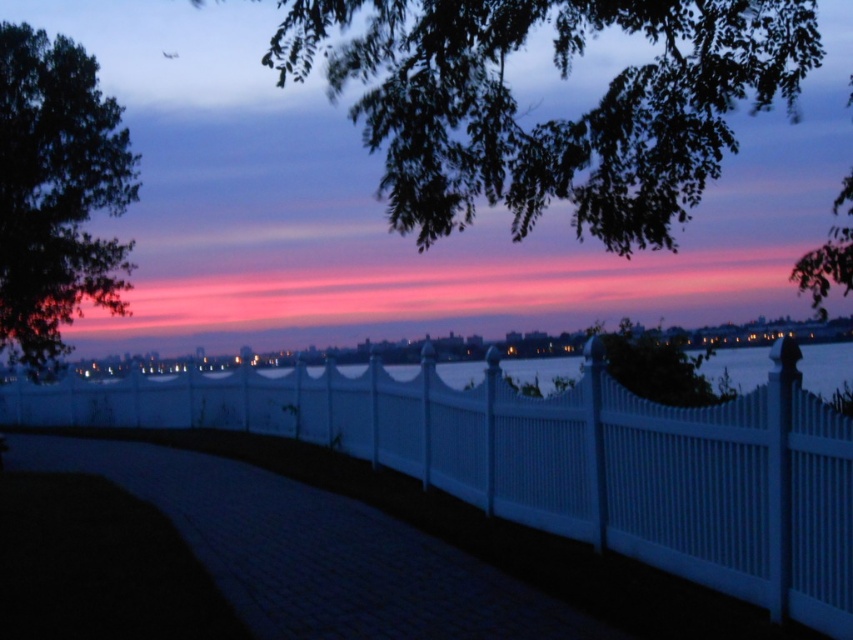
You are an architect designing a new garden. You need to decide whether to place a large decorative statue between the white vinyl fence at center and the green leafy branches at upper center. Considering their sizes, which object should the statue be placed closer to for balance?

The white vinyl fence at center is smaller than the green leafy branches at upper center. To achieve balance, the statue should be placed closer to the larger green leafy branches at upper center to counterbalance their size.

You are a bird flying over the waterfront area at twilight. You want to land on the tallest tree to rest. Which one should you choose between the green leafy branches at upper center and the dark green leafy tree at upper left?

The green leafy branches at upper center is much taller than the dark green leafy tree at upper left, so you should choose the green leafy branches at upper center to land on.